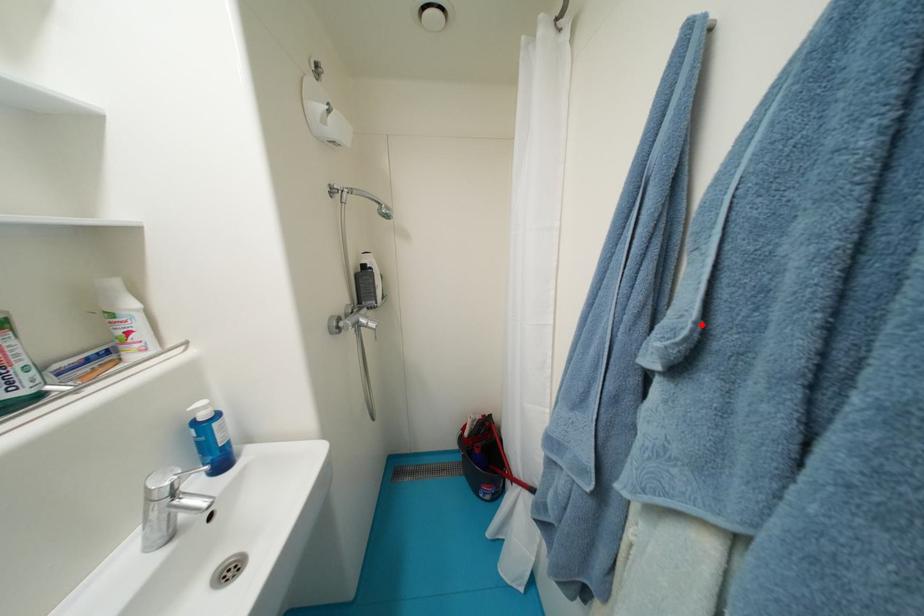
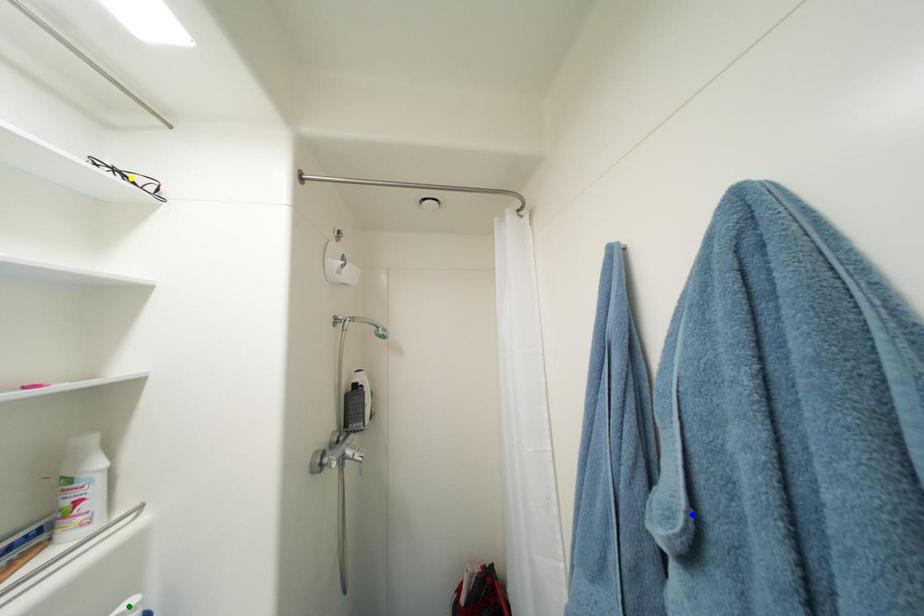
Question: I am providing you with two images of the same scene from different viewpoints. A red point is marked on the first image. You are given multiple points on the second image. Which spot in image 2 lines up with the point in image 1?

Choices:
 (A) blue point
 (B) yellow point
 (C) green point

Answer: (A)